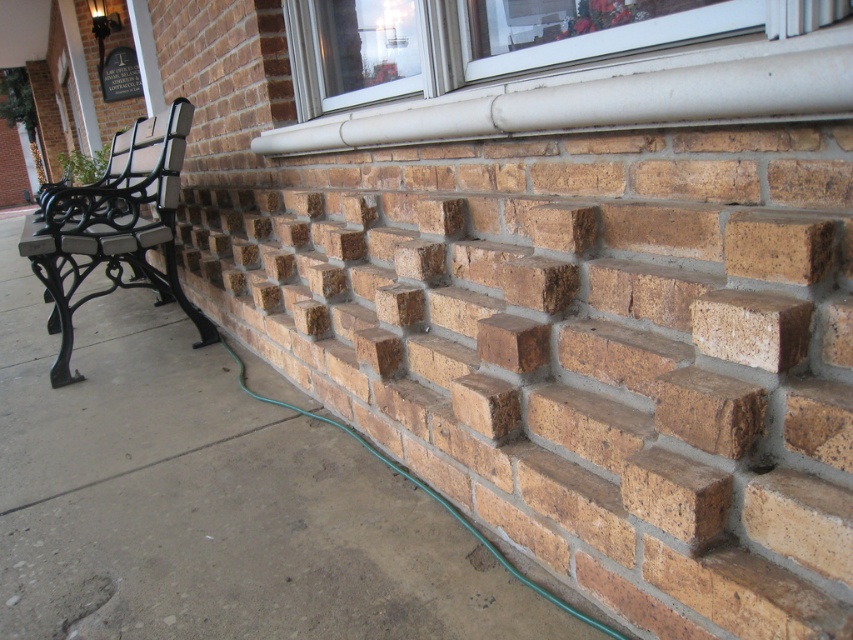
Question: Does black wrought iron bench at left have a greater width compared to brown rough brick at upper right?

Choices:
 (A) no
 (B) yes

Answer: (B)

Question: Which object is closer to the camera taking this photo?

Choices:
 (A) brown rough brick at upper right
 (B) black wrought iron bench at left

Answer: (A)

Question: Which object is closer to the camera taking this photo?

Choices:
 (A) brown brick pavement at lower right
 (B) black wrought iron bench at left

Answer: (A)

Question: Is brown brick pavement at lower right wider than brown rough brick at upper right?

Choices:
 (A) yes
 (B) no

Answer: (A)

Question: Is brown brick pavement at lower right positioned behind black wrought iron bench at left?

Choices:
 (A) no
 (B) yes

Answer: (A)

Question: Which object is the farthest from the black wrought iron bench at left?

Choices:
 (A) brown rough brick at upper right
 (B) brown brick pavement at lower right

Answer: (A)